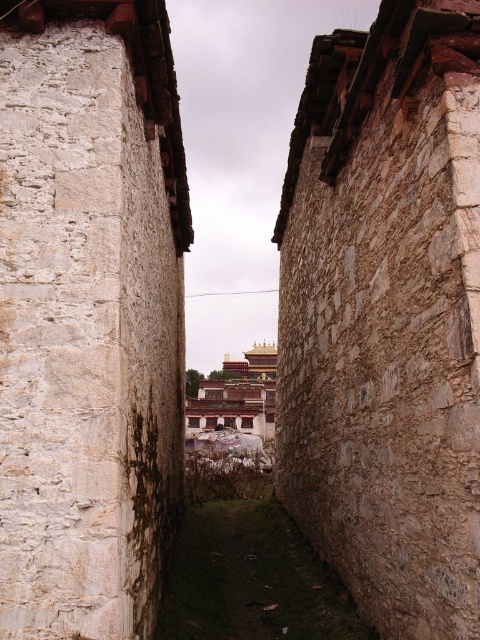
You are standing in the alleyway and want to walk towards the brown stone wall at right. Which direction should you move relative to the white stone monastery at center?

You should move to the right of the white stone monastery at center to reach the brown stone wall at right since the brown stone wall at right is located to the right of the white stone monastery at center.

You are a painter standing in the narrow alleyway between the white stone wall at center and the white stone monastery at center. You want to paint both structures. Which one will require you to look upward more because it is taller?

The white stone monastery at center is taller than the white stone wall at center, so you will need to look upward more to paint the white stone monastery at center.

Based on the photo, you are standing in the narrow alleyway and want to take a photo of both the white stone wall at center and the white stone monastery at center. Which object should you focus on first to ensure both are in the frame?

You should focus on the white stone wall at center first because it is closer to you than the white stone monastery at center, ensuring both are in the frame.